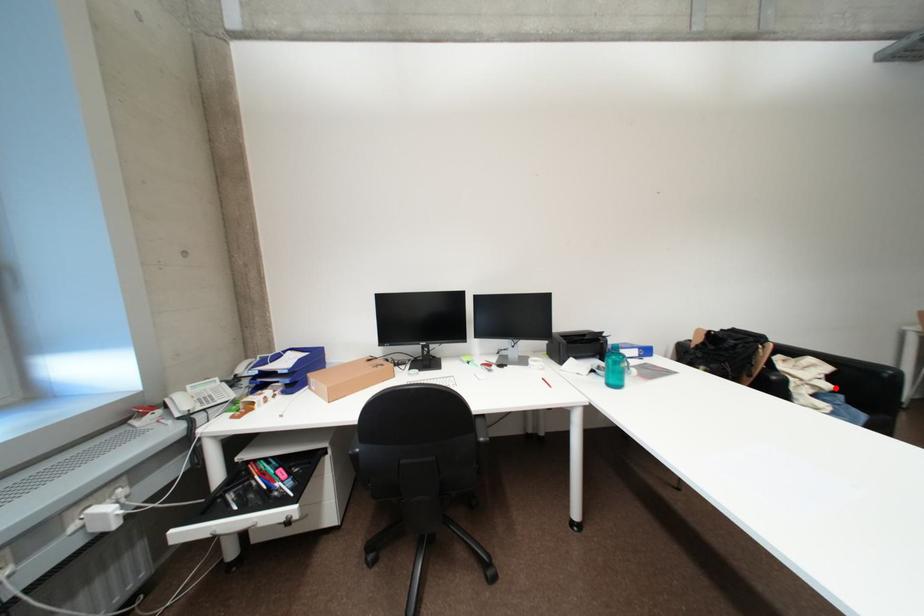
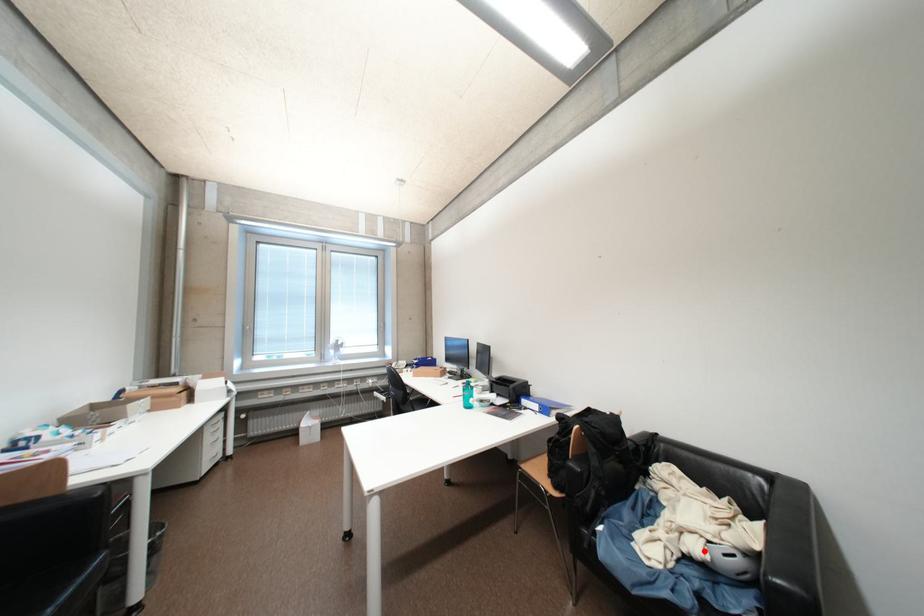
I am providing you with two images of the same scene from different viewpoints. A red point is marked on the first image and another point is marked on the second image. Is the marked point in image1 the same physical position as the marked point in image2?

Yes